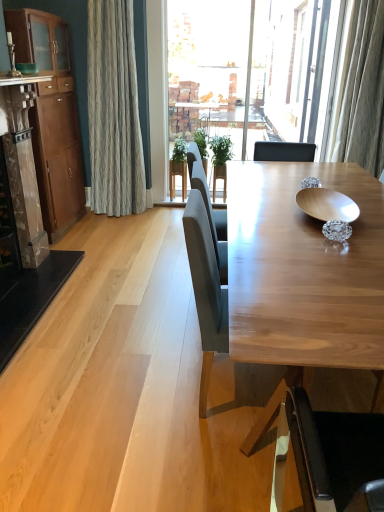
Image resolution: width=384 pixels, height=512 pixels. In order to click on green leafy plant at center in this screenshot , I will do [178, 167].

What do you see at coordinates (52, 118) in the screenshot? I see `brown wood cabinet at left` at bounding box center [52, 118].

What is the approximate width of marble fireplace at left?

marble fireplace at left is 19.99 inches in width.

This screenshot has height=512, width=384. What do you see at coordinates (206, 289) in the screenshot?
I see `matte gray chair at center, the 1th chair viewed from the back` at bounding box center [206, 289].

In the scene shown: What is the approximate width of wooden bowl at center?

It is 12.31 inches.

What is the approximate height of wooden bowl at center?

It is 2.04 inches.

Locate an element on the screen. Image resolution: width=384 pixels, height=512 pixels. green leafy plant at center is located at coordinates (178, 167).

Is brown wood cabinet at left taller than light brown wood chair at center, arranged as the 1th chair when viewed from the front?

Indeed, brown wood cabinet at left has a greater height compared to light brown wood chair at center, arranged as the 1th chair when viewed from the front.

Looking at this image, in terms of width, does brown wood cabinet at left look wider or thinner when compared to light brown wood chair at center, arranged as the 1th chair when viewed from the front?

brown wood cabinet at left is thinner than light brown wood chair at center, arranged as the 1th chair when viewed from the front.

Does point (68, 95) appear closer or farther from the camera than point (316, 460)?

Clearly, point (68, 95) is more distant from the camera than point (316, 460).

Between matte wood counter top at upper left and wooden bowl at center, which one has less height?

wooden bowl at center is shorter.

Looking at this image, how different are the orientations of matte wood counter top at upper left and wooden bowl at center in degrees?

They differ by 179 degrees in their facing directions.

Is matte wood counter top at upper left smaller than wooden bowl at center?

Actually, matte wood counter top at upper left might be larger than wooden bowl at center.

Considering the positions of points (2, 75) and (317, 202), is point (2, 75) closer to camera compared to point (317, 202)?

No, it is not.

Does point (187, 211) come behind point (182, 139)?

No.

How many degrees apart are the facing directions of matte gray chair at center, the second chair viewed from the front, and green leafy plant at center?

They differ by 94 degrees in their facing directions.

The height and width of the screenshot is (512, 384). I want to click on the 1st chair counting from the right of the green leafy plant at center, so click(x=206, y=289).

From a real-world perspective, does matte gray chair at center, the 1th chair viewed from the back, stand above green leafy plant at center?

Yes, from a real-world perspective, matte gray chair at center, the 1th chair viewed from the back, is on top of green leafy plant at center.

Between matte wood counter top at upper left and green leafy plant at center, which one has smaller size?

matte wood counter top at upper left is smaller.

From the image's perspective, does matte wood counter top at upper left appear lower than green leafy plant at center?

No, from the image's perspective, matte wood counter top at upper left is not below green leafy plant at center.

Is point (178, 166) less distant than point (325, 219)?

That is False.

In the scene shown: Which object is closer to the camera, green leafy plant at center or wooden bowl at center?

wooden bowl at center.

Consider the image. Between green leafy plant at center and wooden bowl at center, which one has smaller size?

wooden bowl at center is smaller.

Is green leafy plant at center positioned with its back to wooden bowl at center?

That's not correct — green leafy plant at center is not looking away from wooden bowl at center.

Consider the image. From the image's perspective, would you say wooden bowl at center is shown under matte gray chair at center, the second chair viewed from the front?

Incorrect, from the image's perspective, wooden bowl at center is higher than matte gray chair at center, the second chair viewed from the front.

What's the angular difference between wooden bowl at center and matte gray chair at center, the second chair viewed from the front,'s facing directions?

wooden bowl at center and matte gray chair at center, the second chair viewed from the front, are facing 179 degrees away from each other.

In terms of width, does wooden bowl at center look wider or thinner when compared to matte gray chair at center, the second chair viewed from the front?

In the image, wooden bowl at center appears to be more narrow than matte gray chair at center, the second chair viewed from the front.

Based on their positions, is wooden bowl at center located to the left or right of matte gray chair at center, the second chair viewed from the front?

wooden bowl at center is to the right of matte gray chair at center, the second chair viewed from the front.

Is light brown wood chair at center, acting as the 2th chair starting from the back, to the left of matte gray chair at center, the second chair viewed from the front, from the viewer's perspective?

No, light brown wood chair at center, acting as the 2th chair starting from the back, is not to the left of matte gray chair at center, the second chair viewed from the front.

Is light brown wood chair at center, arranged as the 1th chair when viewed from the front, positioned behind matte gray chair at center, the 1th chair viewed from the back?

No, it is not.

Is light brown wood chair at center, acting as the 2th chair starting from the back, positioned beyond the bounds of matte gray chair at center, the 1th chair viewed from the back?

Indeed, light brown wood chair at center, acting as the 2th chair starting from the back, is completely outside matte gray chair at center, the 1th chair viewed from the back.

Is light brown wood chair at center, arranged as the 1th chair when viewed from the front, next to matte gray chair at center, the second chair viewed from the front, and touching it?

No, light brown wood chair at center, arranged as the 1th chair when viewed from the front, is not touching matte gray chair at center, the second chair viewed from the front.

Image resolution: width=384 pixels, height=512 pixels. I want to click on the 2nd chair to the right of the brown wood cabinet at left, counting from the anchor's position, so click(333, 450).

This screenshot has height=512, width=384. I want to click on counter top above the wooden bowl at center (from a real-world perspective), so click(22, 79).

Considering their positions, is matte gray chair at center, the 1th chair viewed from the back, positioned further to marble fireplace at left than matte wood counter top at upper left?

matte gray chair at center, the 1th chair viewed from the back, is positioned further to the anchor marble fireplace at left.

Based on their spatial positions, is light brown wood chair at center, arranged as the 1th chair when viewed from the front, or wooden bowl at center further from matte wood counter top at upper left?

light brown wood chair at center, arranged as the 1th chair when viewed from the front, is further to matte wood counter top at upper left.

Looking at the image, which one is located further to marble fireplace at left, matte gray chair at center, the 1th chair viewed from the back, or light brown wood chair at center, acting as the 2th chair starting from the back?

Based on the image, light brown wood chair at center, acting as the 2th chair starting from the back, appears to be further to marble fireplace at left.

Considering their positions, is brown wood cabinet at left positioned further to marble fireplace at left than light brown wood chair at center, acting as the 2th chair starting from the back?

light brown wood chair at center, acting as the 2th chair starting from the back, is further to marble fireplace at left.

Considering their positions, is matte wood counter top at upper left positioned closer to brown wood cabinet at left than marble fireplace at left?

marble fireplace at left is positioned closer to the anchor brown wood cabinet at left.

Estimate the real-world distances between objects in this image. Which object is closer to wooden bowl at center, matte wood counter top at upper left or light brown wood chair at center, arranged as the 1th chair when viewed from the front?

The object closer to wooden bowl at center is light brown wood chair at center, arranged as the 1th chair when viewed from the front.

From the image, which object appears to be nearer to brown wood cabinet at left, marble fireplace at left or matte wood counter top at upper left?

Among the two, marble fireplace at left is located nearer to brown wood cabinet at left.

Based on their spatial positions, is light brown wood chair at center, acting as the 2th chair starting from the back, or matte wood counter top at upper left further from marble fireplace at left?

Based on the image, light brown wood chair at center, acting as the 2th chair starting from the back, appears to be further to marble fireplace at left.

The width and height of the screenshot is (384, 512). Identify the location of counter top positioned between wooden bowl at center and green leafy plant at center from near to far. coord(22,79).

This screenshot has height=512, width=384. Find the location of `bowl between light brown wood chair at center, arranged as the 1th chair when viewed from the front, and brown wood cabinet at left from front to back`. bowl between light brown wood chair at center, arranged as the 1th chair when viewed from the front, and brown wood cabinet at left from front to back is located at coordinates pos(327,205).

You are a GUI agent. You are given a task and a screenshot of the screen. Output one action in this format:
    pyautogui.click(x=<x>, y=<y>)
    Task: Click on the chair between light brown wood chair at center, acting as the 2th chair starting from the back, and wooden bowl at center from front to back
    
    Given the screenshot: What is the action you would take?
    pyautogui.click(x=206, y=289)

Locate an element on the screen. The width and height of the screenshot is (384, 512). counter top between matte gray chair at center, the second chair viewed from the front, and green leafy plant at center, along the z-axis is located at coordinates (22, 79).